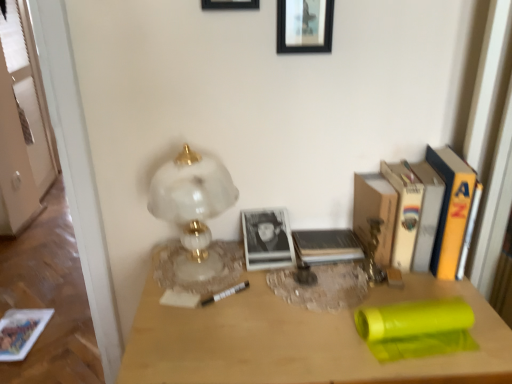
Question: Considering the positions of white marble lamp at left and matte paper book at lower left in the image, is white marble lamp at left taller or shorter than matte paper book at lower left?

Choices:
 (A) tall
 (B) short

Answer: (A)

Question: From a real-world perspective, is white marble lamp at left physically located above or below matte paper book at lower left?

Choices:
 (A) below
 (B) above

Answer: (B)

Question: Estimate the real-world distances between objects in this image. Which object is farther from the black matte picture frame at upper center, placed as the second picture frame when sorted from right to left?

Choices:
 (A) matte wood desk at center
 (B) black matte picture frame at upper center, which ranks as the 1th picture frame in right-to-left order
 (C) matte cardboard book at center-right, positioned as the 2th paperback book in left-to-right order
 (D) matte paper book at lower left
 (E) white paper at right, which appears as the 2th paperback book when viewed from the right

Answer: (D)

Question: Which object is the closest to the white marble lamp at left?

Choices:
 (A) white paper at right, which appears as the 2th paperback book when viewed from the right
 (B) black matte picture frame at upper center, which ranks as the 1th picture frame in right-to-left order
 (C) matte paper book at lower left
 (D) matte cardboard book at center-right, positioned as the 2th paperback book in left-to-right order
 (E) black matte picture frame at upper center, placed as the second picture frame when sorted from right to left

Answer: (D)